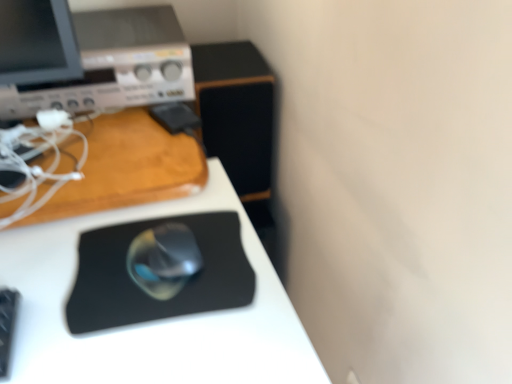
Question: Is satin silver mouse at center to the right of matte silver desktop computer at upper left from the viewer's perspective?

Choices:
 (A) yes
 (B) no

Answer: (A)

Question: Is the depth of satin silver mouse at center greater than that of matte silver desktop computer at upper left?

Choices:
 (A) no
 (B) yes

Answer: (A)

Question: Is satin silver mouse at center shorter than matte silver desktop computer at upper left?

Choices:
 (A) no
 (B) yes

Answer: (B)

Question: Is satin silver mouse at center bigger than matte silver desktop computer at upper left?

Choices:
 (A) yes
 (B) no

Answer: (B)

Question: Is satin silver mouse at center far from matte silver desktop computer at upper left?

Choices:
 (A) no
 (B) yes

Answer: (A)

Question: Which is correct: matte silver desktop computer at upper left is inside black matte mouse pad at center, or outside of it?

Choices:
 (A) outside
 (B) inside

Answer: (A)

Question: Considering the relative positions of matte silver desktop computer at upper left and black matte mouse pad at center in the image provided, is matte silver desktop computer at upper left to the left or to the right of black matte mouse pad at center?

Choices:
 (A) right
 (B) left

Answer: (B)

Question: Looking at their shapes, would you say matte silver desktop computer at upper left is wider or thinner than black matte mouse pad at center?

Choices:
 (A) thin
 (B) wide

Answer: (A)

Question: Based on their sizes in the image, would you say matte silver desktop computer at upper left is bigger or smaller than black matte mouse pad at center?

Choices:
 (A) small
 (B) big

Answer: (A)

Question: From a real-world perspective, is black matte mouse pad at center positioned above or below black rubber mousepad at center?

Choices:
 (A) above
 (B) below

Answer: (B)

Question: From the image's perspective, relative to black rubber mousepad at center, is black matte mouse pad at center above or below?

Choices:
 (A) below
 (B) above

Answer: (A)

Question: Looking at the image, does black matte mouse pad at center seem bigger or smaller compared to black rubber mousepad at center?

Choices:
 (A) small
 (B) big

Answer: (B)

Question: Is black matte mouse pad at center inside the boundaries of black rubber mousepad at center, or outside?

Choices:
 (A) inside
 (B) outside

Answer: (B)

Question: Is satin silver mouse at center wider or thinner than black rubber mousepad at center?

Choices:
 (A) wide
 (B) thin

Answer: (B)

Question: Do you think satin silver mouse at center is within black rubber mousepad at center, or outside of it?

Choices:
 (A) outside
 (B) inside

Answer: (A)